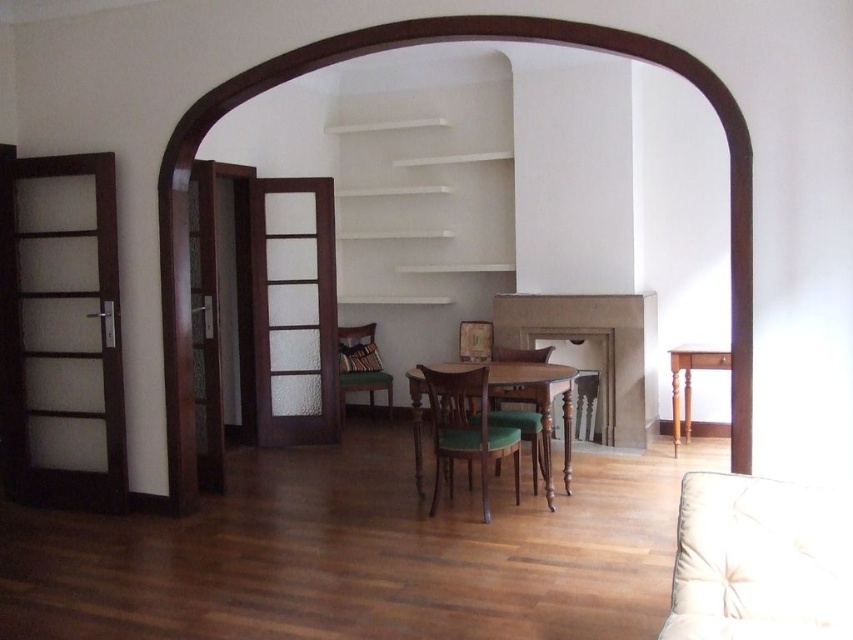
Is point (715, 83) positioned after point (381, 385)?

No, it is not.

Consider the image. Between brown wood archway at center and green fabric armchair at center, which one has less height?

green fabric armchair at center is shorter.

What do you see at coordinates (412, 44) in the screenshot? This screenshot has height=640, width=853. I see `brown wood archway at center` at bounding box center [412, 44].

The width and height of the screenshot is (853, 640). What are the coordinates of `brown wood archway at center` in the screenshot? It's located at (412, 44).

Between white matte shelves at upper center and wooden table at center, which one is positioned higher?

Positioned higher is white matte shelves at upper center.

Is white matte shelves at upper center to the right of wooden table at center from the viewer's perspective?

Incorrect, white matte shelves at upper center is not on the right side of wooden table at center.

Is point (509, 214) farther from camera compared to point (486, 387)?

Yes, it is.

Where is `white matte shelves at upper center`? This screenshot has height=640, width=853. white matte shelves at upper center is located at coordinates (422, 209).

Looking at this image, is beige fabric armchair at lower right positioned behind green fabric chair at center?

No, it is not.

Describe the element at coordinates (759, 561) in the screenshot. I see `beige fabric armchair at lower right` at that location.

This screenshot has width=853, height=640. In order to click on beige fabric armchair at lower right in this screenshot , I will do `click(759, 561)`.